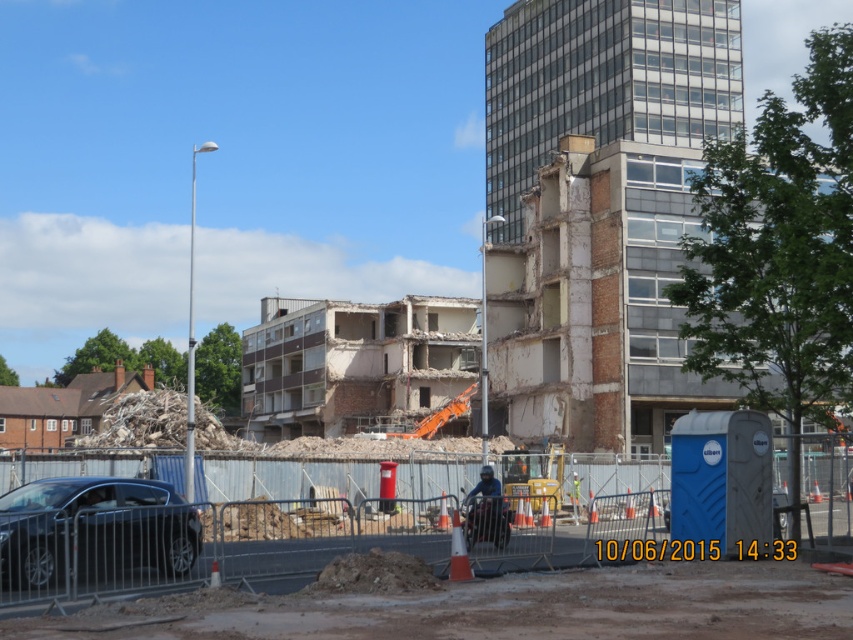
Question: Estimate the real-world distances between objects in this image. Which object is closer to the concrete barrier at center?

Choices:
 (A) blue fabric construction worker at center
 (B) shiny black sedan at lower left

Answer: (B)

Question: From the image, what is the correct spatial relationship of concrete barrier at center in relation to shiny black sedan at lower left?

Choices:
 (A) left
 (B) right

Answer: (B)

Question: Does shiny black sedan at lower left have a smaller size compared to blue fabric construction worker at center?

Choices:
 (A) no
 (B) yes

Answer: (A)

Question: Where is concrete barrier at center located in relation to blue plastic website at center in the image?

Choices:
 (A) below
 (B) above

Answer: (A)

Question: Among these objects, which one is nearest to the camera?

Choices:
 (A) blue plastic website at center
 (B) blue fabric construction worker at center
 (C) shiny black sedan at lower left

Answer: (C)

Question: Which point is farther from the camera taking this photo?

Choices:
 (A) (463, 499)
 (B) (120, 525)
 (C) (90, 634)
 (D) (762, 556)

Answer: (A)